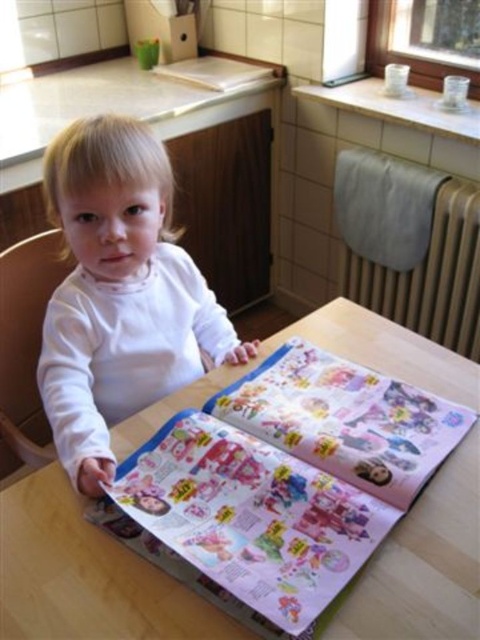
Question: Among these points, which one is farthest from the camera?

Choices:
 (A) (436, 518)
 (B) (242, 353)
 (C) (2, 388)

Answer: (C)

Question: Is wooden table at center positioned before wooden chair at left?

Choices:
 (A) no
 (B) yes

Answer: (B)

Question: Which point is farther to the camera?

Choices:
 (A) white matte toddler at center
 (B) wooden chair at left

Answer: (B)

Question: Which of these objects is positioned closest to the wooden chair at left?

Choices:
 (A) wooden table at center
 (B) white matte toddler at center

Answer: (B)

Question: Is wooden table at center bigger than wooden chair at left?

Choices:
 (A) yes
 (B) no

Answer: (A)

Question: Can you confirm if wooden table at center is wider than wooden chair at left?

Choices:
 (A) yes
 (B) no

Answer: (A)